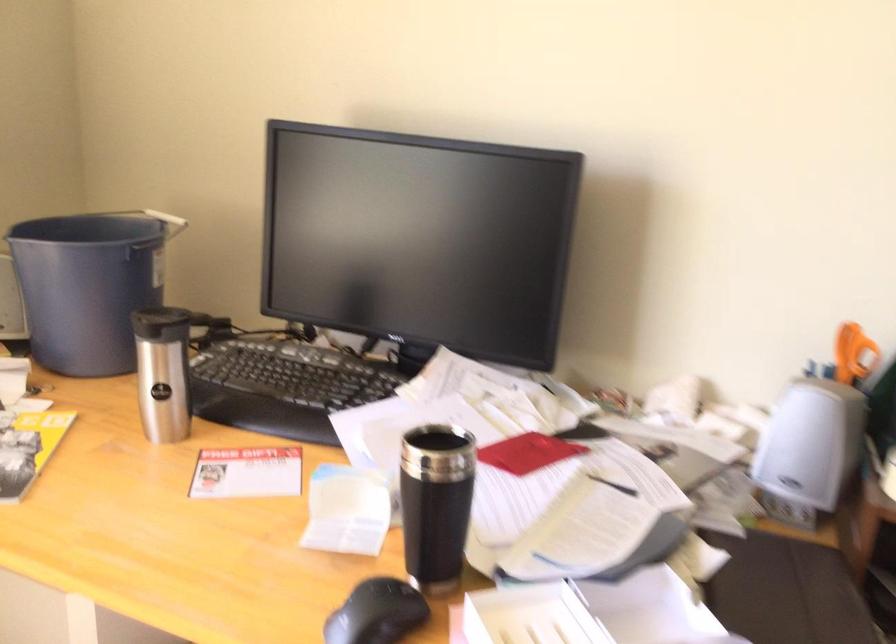
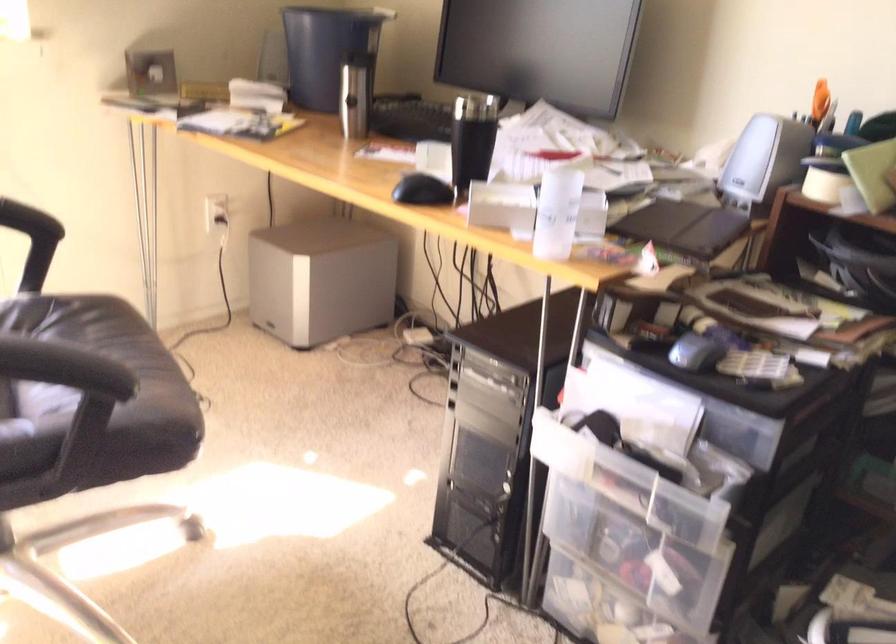
Question: The first image is from the beginning of the video and the second image is from the end. How did the camera likely rotate when shooting the video?

Choices:
 (A) Left
 (B) Right
 (C) Up
 (D) Down

Answer: (A)